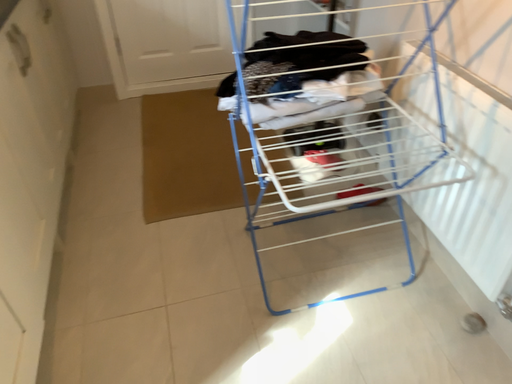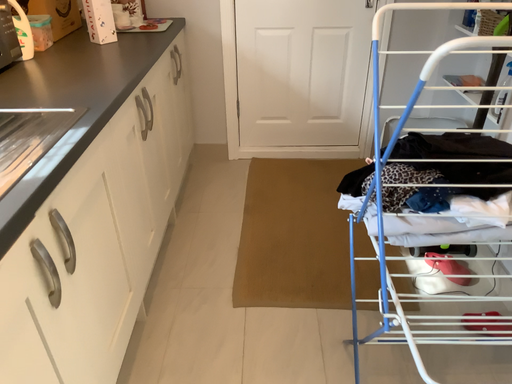
Question: Which way did the camera rotate in the video?

Choices:
 (A) rotated left
 (B) rotated right

Answer: (A)